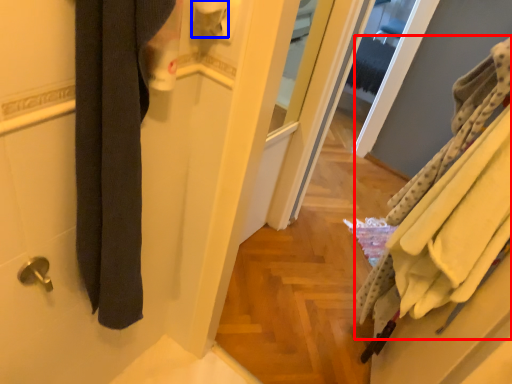
Question: Among these objects, which one is nearest to the camera, bath towel (highlighted by a red box) or toilet paper (highlighted by a blue box)?

Choices:
 (A) bath towel
 (B) toilet paper

Answer: (B)